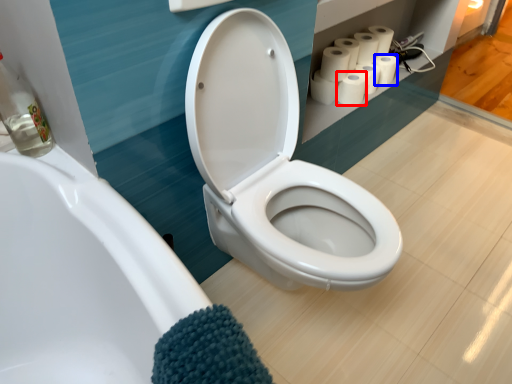
Question: Which of the following is the farthest to the observer, paper towel (highlighted by a red box) or toilet paper (highlighted by a blue box)?

Choices:
 (A) paper towel
 (B) toilet paper

Answer: (B)